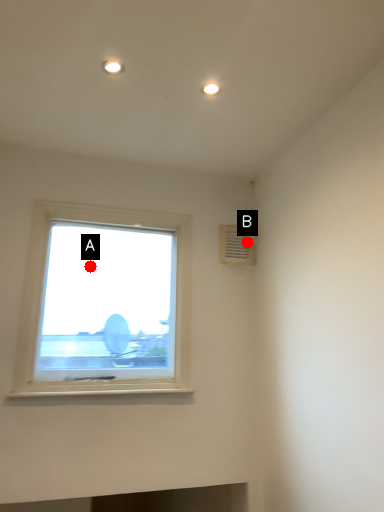
Question: Two points are circled on the image, labeled by A and B beside each circle. Which point appears farthest from the camera in this image?

Choices:
 (A) A is further
 (B) B is further

Answer: (B)